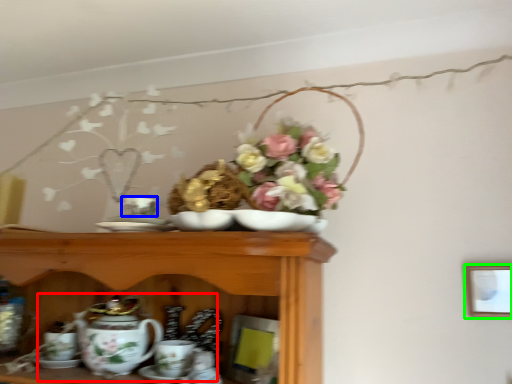
Question: Estimate the real-world distances between objects in this image. Which object is farther from tea set (highlighted by a red box), tableware (highlighted by a blue box) or picture frame (highlighted by a green box)?

Choices:
 (A) tableware
 (B) picture frame

Answer: (B)